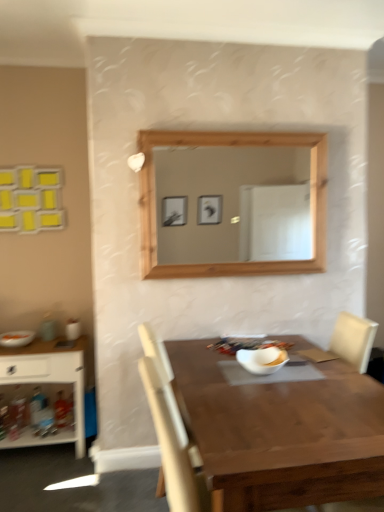
Question: In the image, is white matte bowl at center, the first food when ordered from right to left, positioned in front of or behind matte orange bowl at left, the 2th food in the front-to-back sequence?

Choices:
 (A) front
 (B) behind

Answer: (A)

Question: Is white matte bowl at center, which appears as the second food when viewed from the back, bigger or smaller than matte orange bowl at left, the 2th food in the front-to-back sequence?

Choices:
 (A) big
 (B) small

Answer: (B)

Question: Based on their relative distances, which object is farther from the white wood shelf at left?

Choices:
 (A) white matte bowl at center, the first food when ordered from right to left
 (B) white glossy bowl at center
 (C) matte orange bowl at left, which is counted as the first food, starting from the back
 (D) wooden table at center

Answer: (A)

Question: Which object is the closest to the white glossy bowl at center?

Choices:
 (A) white wood shelf at left
 (B) wooden table at center
 (C) matte orange bowl at left, the 2th food in the front-to-back sequence
 (D) white matte bowl at center, which appears as the second food when viewed from the back

Answer: (D)